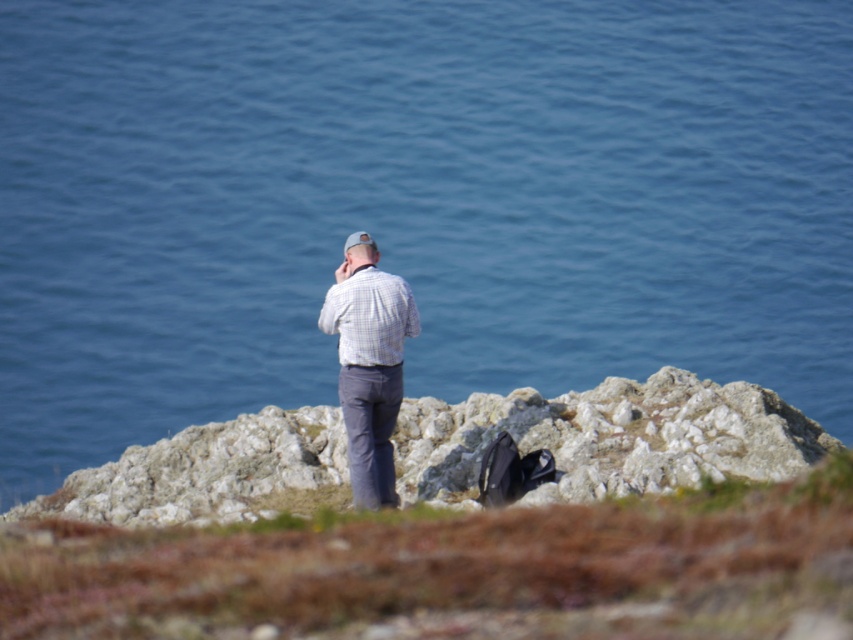
What do you see at coordinates (608, 436) in the screenshot?
I see `rugged stone cliff at center` at bounding box center [608, 436].

From the picture: Is rugged stone cliff at center further to the viewer compared to white checkered shirt at center?

That is False.

Does point (447, 456) come closer to viewer compared to point (364, 289)?

No, it is not.

Image resolution: width=853 pixels, height=640 pixels. I want to click on rugged stone cliff at center, so click(x=608, y=436).